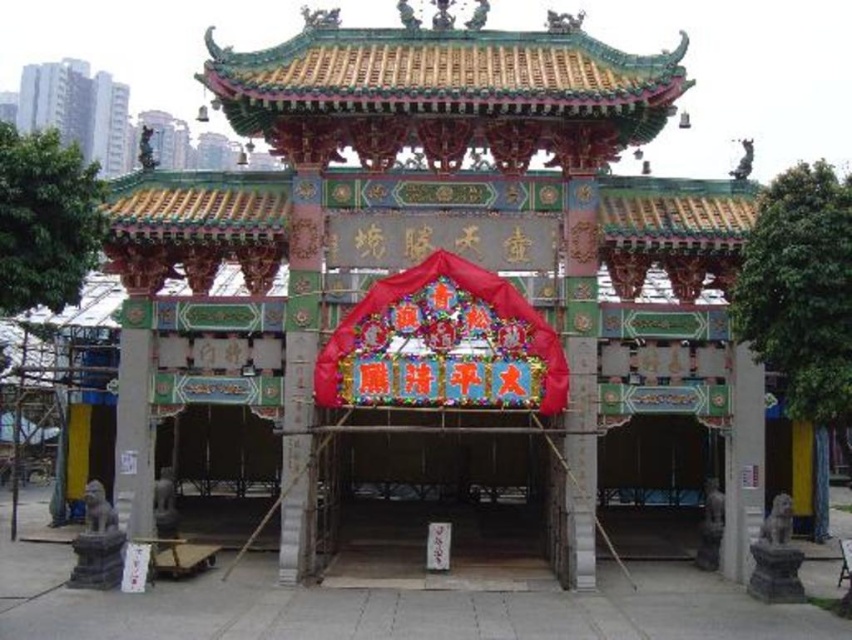
Consider the image. Is multicolored painted wooden gazebo at center above shiny red fabric canopy at center?

Actually, multicolored painted wooden gazebo at center is below shiny red fabric canopy at center.

In the scene shown: Who is higher up, multicolored painted wooden gazebo at center or shiny red fabric canopy at center?

shiny red fabric canopy at center is higher up.

Is point (401, 266) less distant than point (544, 324)?

That is False.

The image size is (852, 640). What are the coordinates of `multicolored painted wooden gazebo at center` in the screenshot? It's located at (440, 262).

Who is more distant from viewer, (436, 468) or (406, 296)?

Point (436, 468)

Does wooden gate at center have a lesser width compared to shiny red fabric canopy at center?

Incorrect, wooden gate at center's width is not less than shiny red fabric canopy at center's.

Is point (471, 435) positioned in front of point (501, 385)?

No, (471, 435) is behind (501, 385).

At what (x,y) coordinates should I click in order to perform the action: click on wooden gate at center. Please return your answer as a coordinate pair (x, y). This screenshot has width=852, height=640. Looking at the image, I should click on (438, 500).

Is multicolored painted wooden gazebo at center to the left of wooden gate at center from the viewer's perspective?

No, multicolored painted wooden gazebo at center is not to the left of wooden gate at center.

Between multicolored painted wooden gazebo at center and wooden gate at center, which one appears on the left side from the viewer's perspective?

Positioned to the left is wooden gate at center.

You are a GUI agent. You are given a task and a screenshot of the screen. Output one action in this format:
    pyautogui.click(x=<x>, y=<y>)
    Task: Click on the multicolored painted wooden gazebo at center
    The width and height of the screenshot is (852, 640).
    Given the screenshot: What is the action you would take?
    pyautogui.click(x=440, y=262)